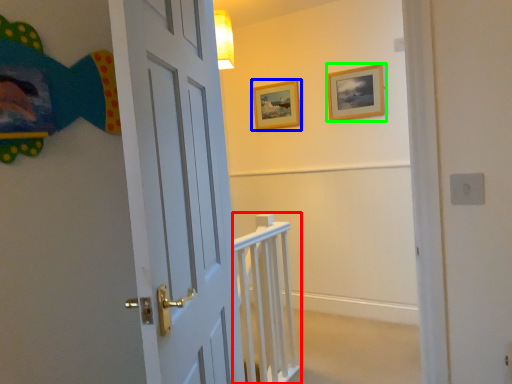
Question: Considering the real-world distances, which object is closest to rail (highlighted by a red box)? picture frame (highlighted by a blue box) or picture frame (highlighted by a green box).

Choices:
 (A) picture frame
 (B) picture frame

Answer: (B)